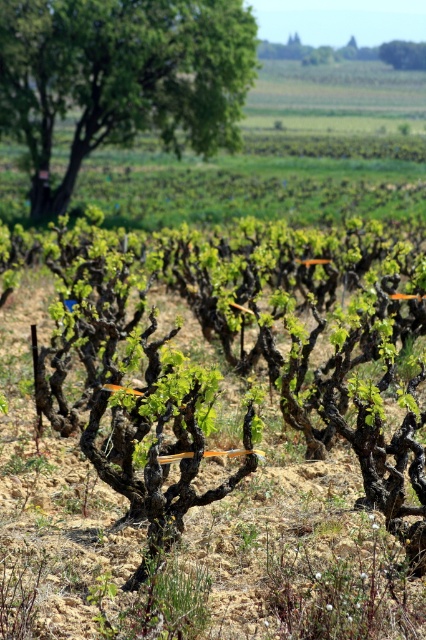
Is the position of green leafy tree at upper left more distant than that of green leafy tree at upper center?

No, it is in front of green leafy tree at upper center.

Is green leafy tree at upper left bigger than green leafy tree at upper center?

Correct, green leafy tree at upper left is larger in size than green leafy tree at upper center.

The width and height of the screenshot is (426, 640). What do you see at coordinates (120, 77) in the screenshot? I see `green leafy tree at upper left` at bounding box center [120, 77].

The width and height of the screenshot is (426, 640). Find the location of `green leafy tree at upper left`. green leafy tree at upper left is located at coordinates (120, 77).